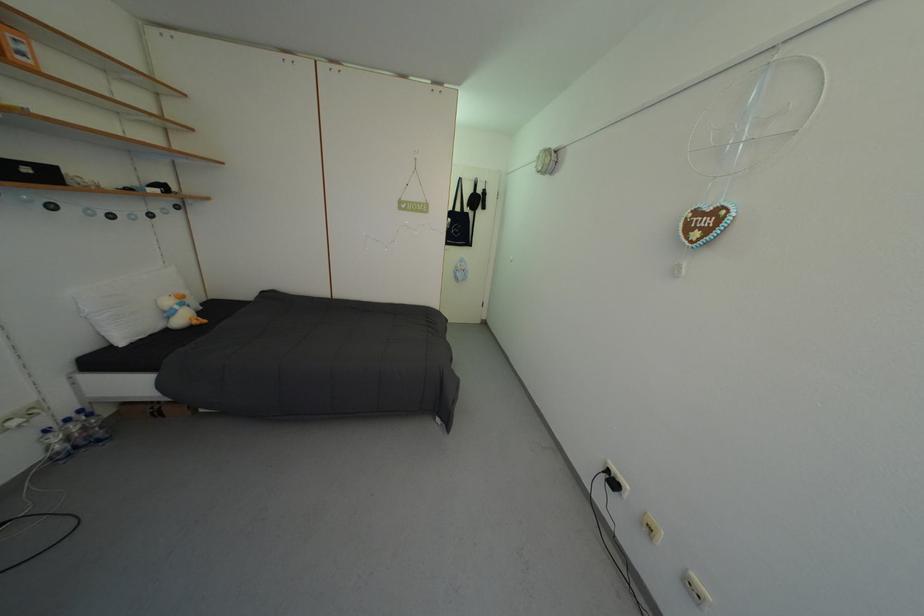
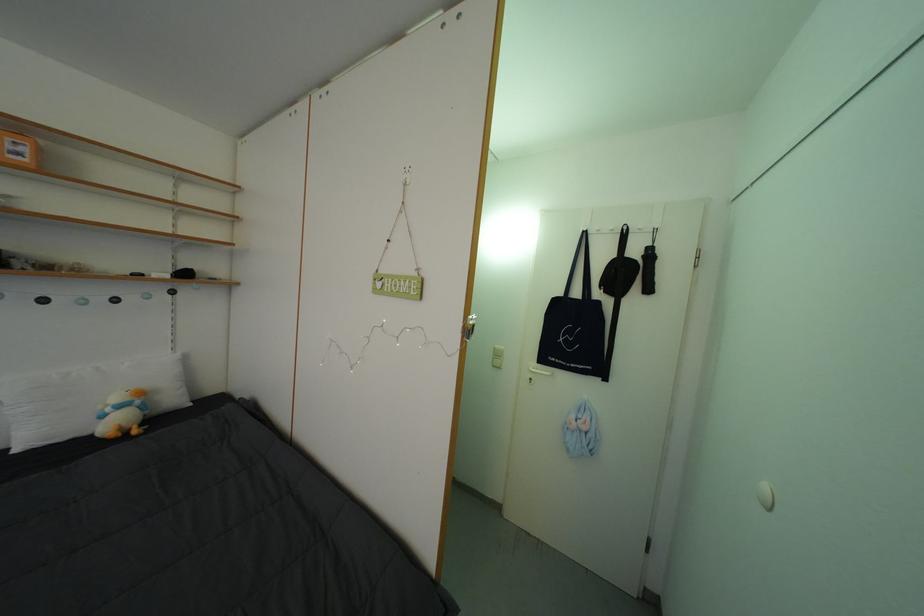
Locate, in the second image, the point that corresponds to pixel 186 313 in the first image.

(117, 415)